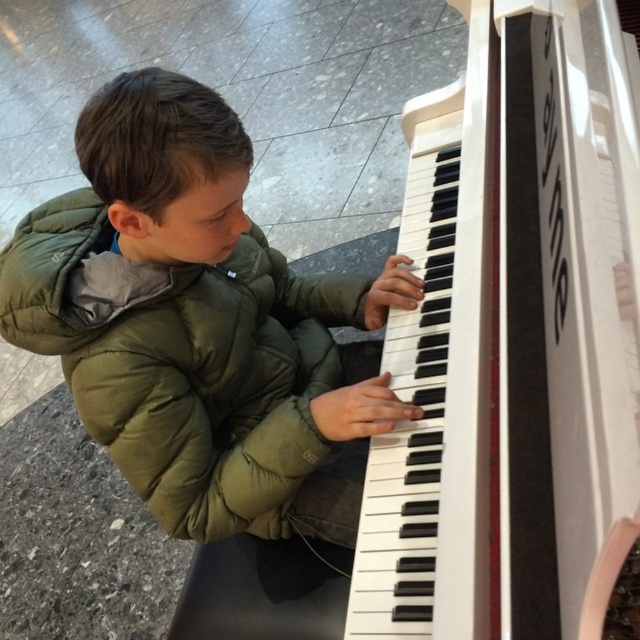
You are a photographer setting up a shoot in the scene. You need to place a microphone on the floor near the green puffy jacket at center so it can pick up the boy playing the white glossy piano at center. Will the microphone be placed under the piano?

The white glossy piano at center is above the green puffy jacket at center, so placing the microphone on the floor near the green puffy jacket at center would indeed be under the piano.

You are a piano teacher observing a student playing the white glossy piano at center. The student is wearing a green puffy jacket at center. If the recommended distance between the student and the piano is 30 centimeters for proper posture, is the student positioned correctly?

The distance between the white glossy piano at center and green puffy jacket at center is 33.09 centimeters, which exceeds the recommended 30 centimeters. Therefore, the student is positioned too far from the piano for proper posture.